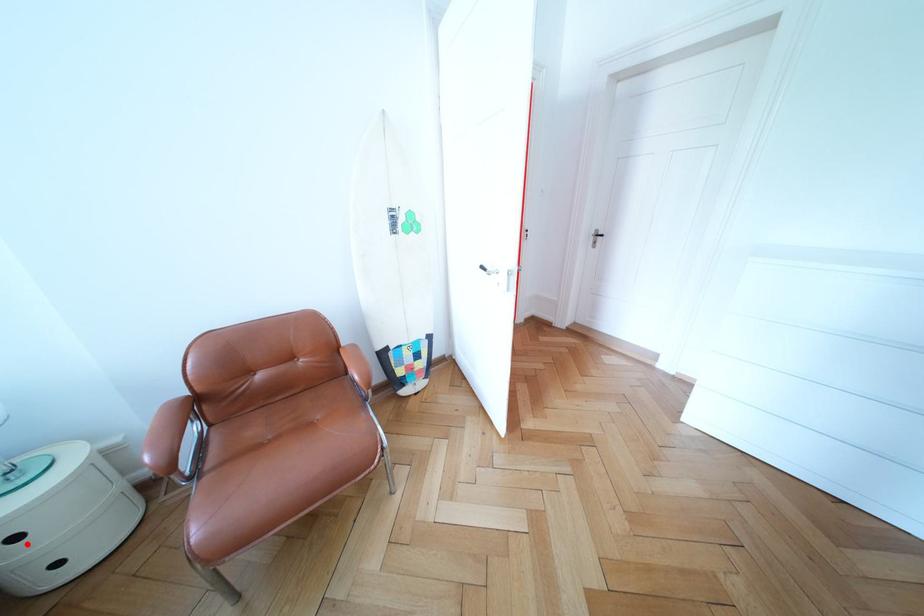
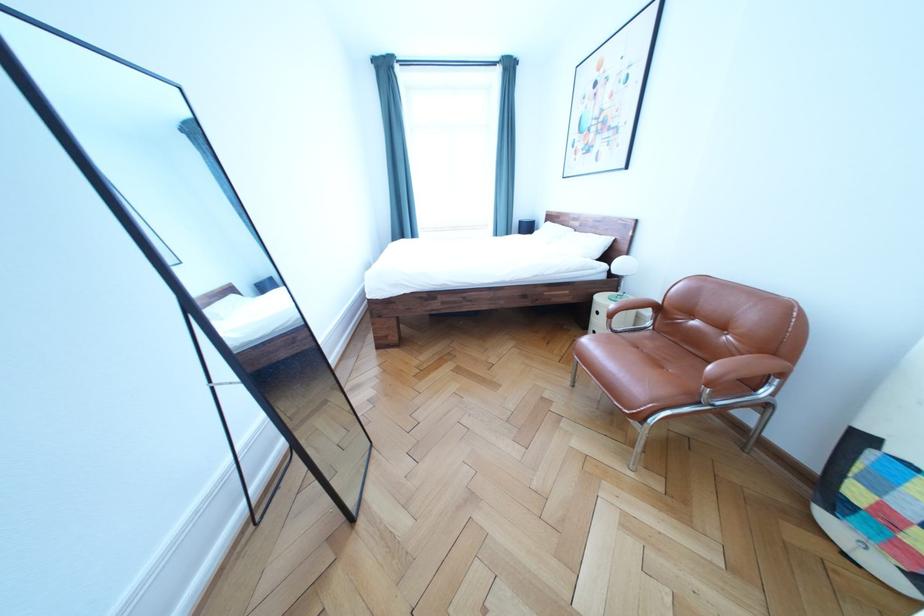
Question: I am providing you with two images of the same scene from different viewpoints. A red point is shown in image1. For the corresponding object point in image2, is it positioned nearer or farther from the camera?

Choices:
 (A) Nearer
 (B) Farther

Answer: (A)